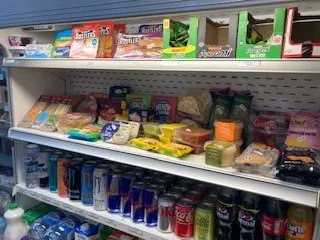
Where is `supermarket shelf`? The width and height of the screenshot is (320, 240). supermarket shelf is located at coordinates (153, 63), (133, 158), (116, 221).